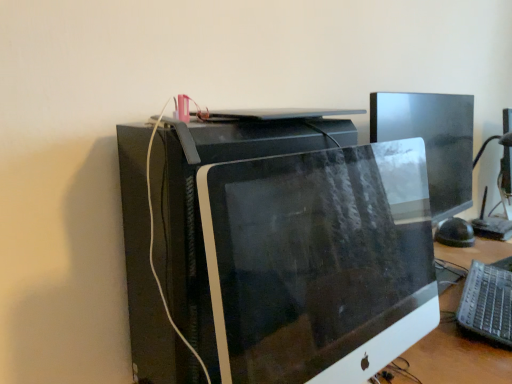
Identify the location of free spot above silver metallic keyboard at lower right (from a real-world perspective). The image size is (512, 384). (492, 282).